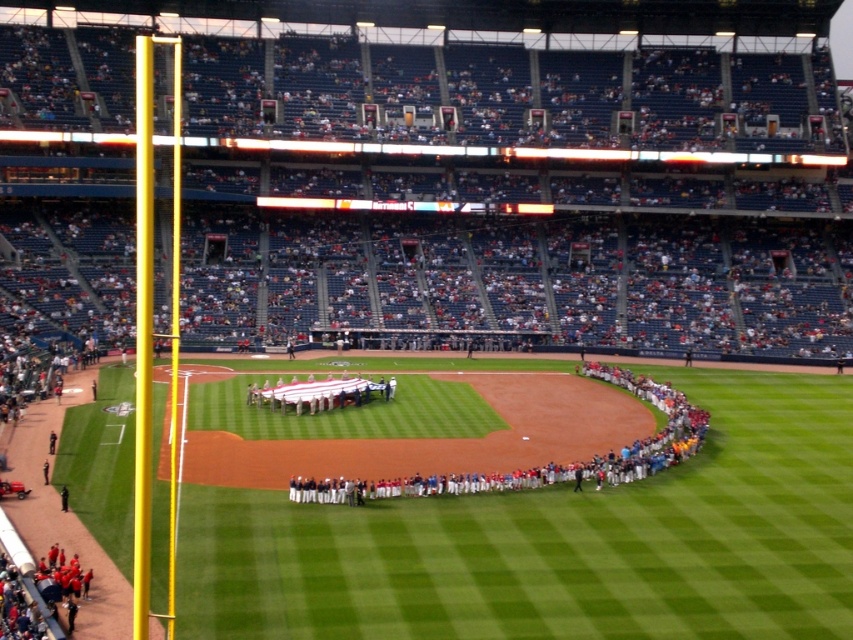
How much distance is there between green grass field at center and white uniformed players at center?

green grass field at center is 6.05 meters away from white uniformed players at center.

Which is more to the left, green grass field at center or white uniformed players at center?

From the viewer's perspective, green grass field at center appears more on the left side.

Locate an element on the screen. This screenshot has height=640, width=853. green grass field at center is located at coordinates (560, 541).

The image size is (853, 640). Find the location of `green grass field at center`. green grass field at center is located at coordinates (560, 541).